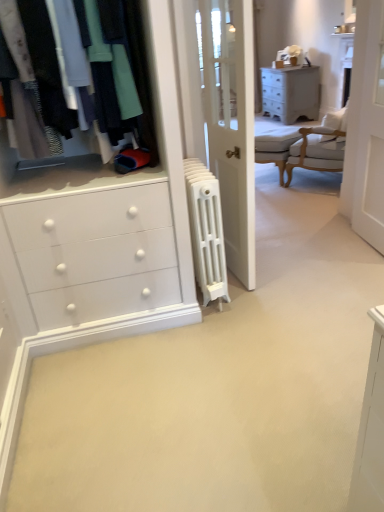
Identify the location of vacant region in front of white wood screen door at upper right. The height and width of the screenshot is (512, 384). (360, 272).